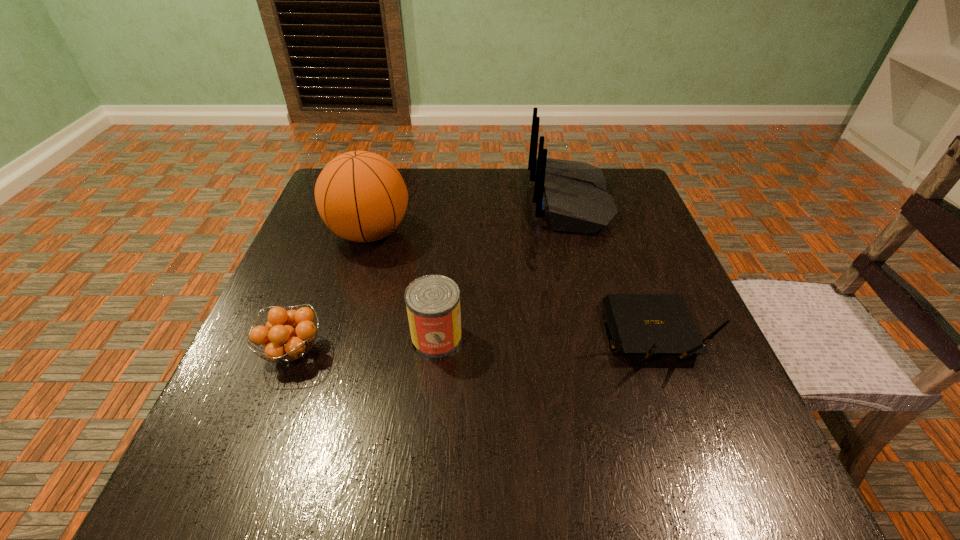
Where is `the taller router`? the taller router is located at coordinates (572, 195).

In order to click on basketball in this screenshot , I will do click(x=361, y=196).

The width and height of the screenshot is (960, 540). I want to click on the third object from right to left, so click(433, 301).

Where is `the third tallest object`? the third tallest object is located at coordinates (433, 301).

The width and height of the screenshot is (960, 540). Find the location of `the shorter router`. the shorter router is located at coordinates (642, 324).

Identify the location of orange fruit. pos(281,340).

Image resolution: width=960 pixels, height=540 pixels. I want to click on vacant space located on the back of the taller router, so click(x=492, y=201).

Locate an element on the screen. free space located 0.150m on the back of the taller router is located at coordinates coord(472,201).

Identify the location of vacant space located 0.270m on the back of the taller router. The height and width of the screenshot is (540, 960). (426, 201).

Find the location of a particular element. vacant point located 0.060m on the left of the basketball is located at coordinates (302, 233).